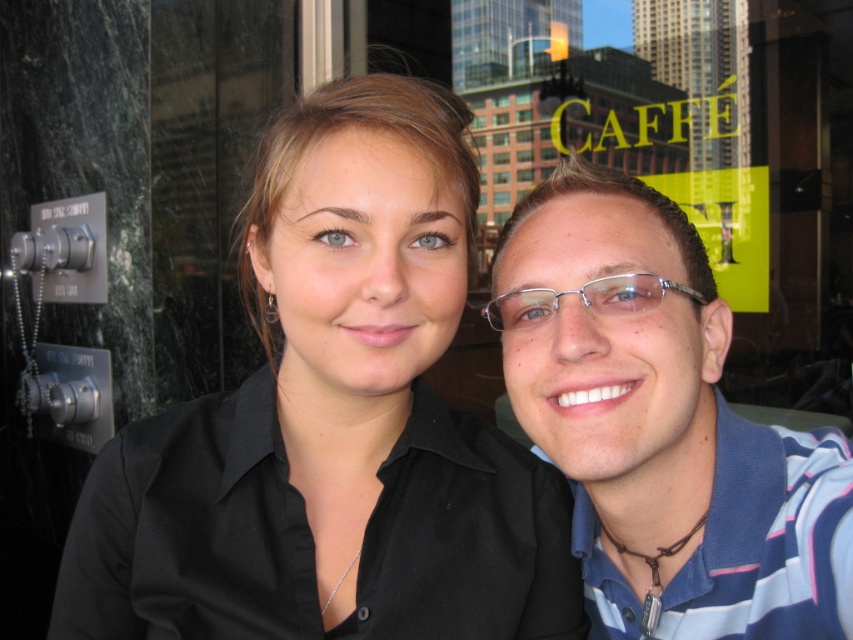
You are a photographer trying to focus on the black matte shirt at center and the blue striped polo shirt at right. Which one is closer to the camera?

The black matte shirt at center is closer to the camera because it is positioned over the blue striped polo shirt at right.

You are standing in front of the photograph and want to place a sticker on the point that is closer to the camera. Which point should you choose between point [340,568] and point [654,276]?

Point [654,276] is closer to the camera than point [340,568], so you should place the sticker on point [654,276].